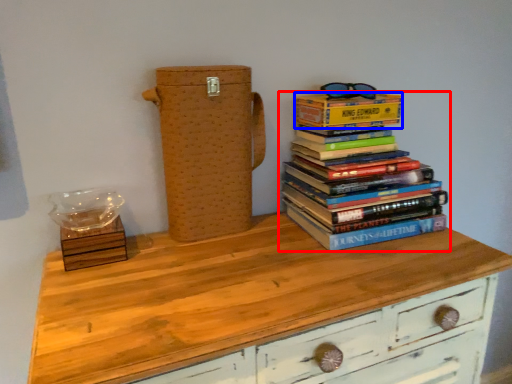
Question: Which object appears closest to the camera in this image, book (highlighted by a red box) or paperback book (highlighted by a blue box)?

Choices:
 (A) book
 (B) paperback book

Answer: (A)